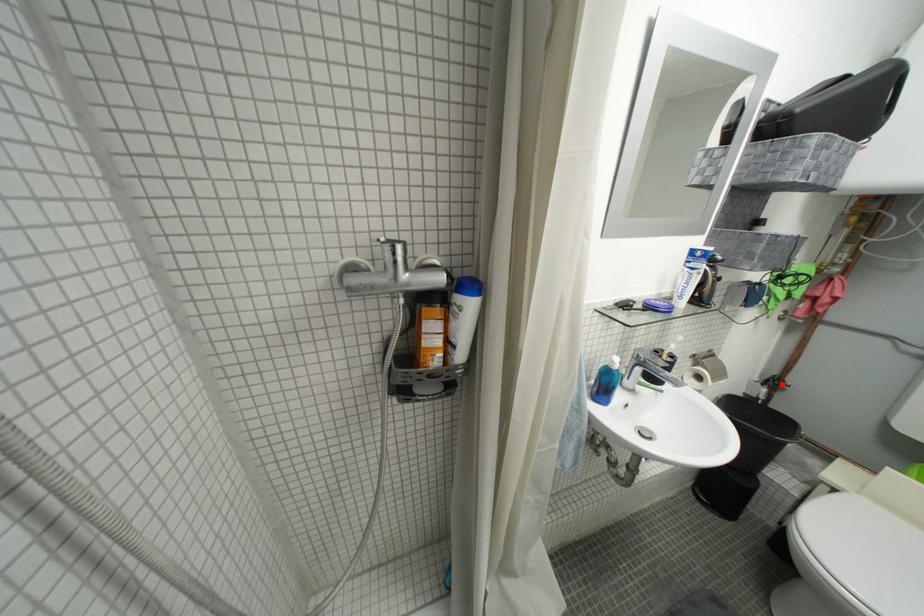
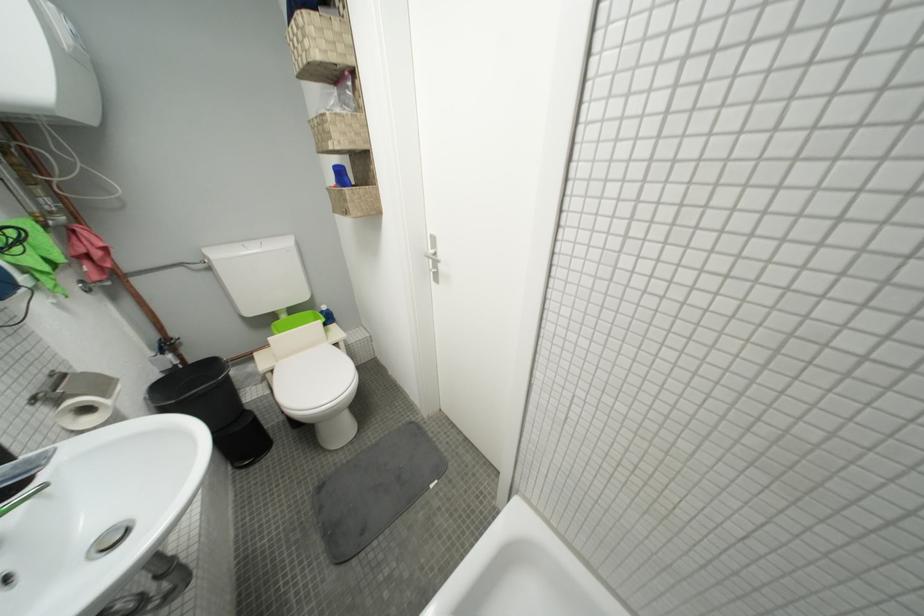
Find the pixel in the second image that matches the highlighted location in the first image.

(175, 347)